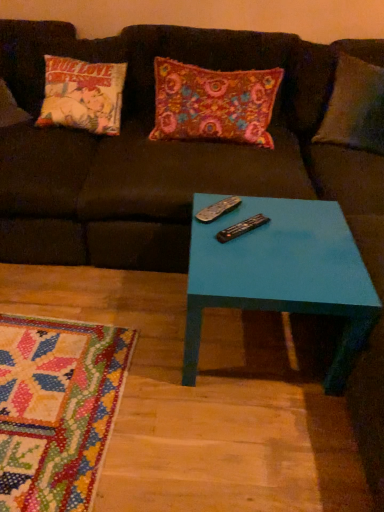
Question: Does point (347, 232) appear closer or farther from the camera than point (240, 224)?

Choices:
 (A) farther
 (B) closer

Answer: (A)

Question: Choose the correct answer: Is teal glossy table at center inside black plastic remote at center, the 2th remote in the back-to-front sequence, or outside it?

Choices:
 (A) outside
 (B) inside

Answer: (A)

Question: Which of these objects is positioned farthest from the black plastic remote at center, the 2th remote in the back-to-front sequence?

Choices:
 (A) teal glossy table at center
 (B) floral fabric pillow at center
 (C) black plastic remote at center, arranged as the 1th remote when viewed from the back

Answer: (B)

Question: Estimate the real-world distances between objects in this image. Which object is farther from the teal glossy table at center?

Choices:
 (A) black plastic remote at center, which is counted as the 2th remote, starting from the front
 (B) floral fabric pillow at center
 (C) black plastic remote at center, which is the first remote in front-to-back order

Answer: (B)